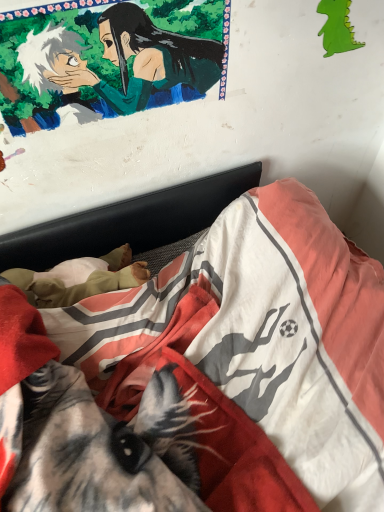
At what (x,y) coordinates should I click in order to perform the action: click on green paper dragon at upper right. Please return your answer as a coordinate pair (x, y). This screenshot has width=384, height=512. Looking at the image, I should click on (337, 27).

Measure the distance between point (28,459) and camera.

Point (28,459) is 27.87 inches away from camera.

Where is `soft cotton bed at center`? soft cotton bed at center is located at coordinates (206, 376).

You are a GUI agent. You are given a task and a screenshot of the screen. Output one action in this format:
    pyautogui.click(x=<x>, y=<y>)
    Task: Click on the green paper dragon at upper right
    Image resolution: width=384 pixels, height=512 pixels.
    Given the screenshot: What is the action you would take?
    pyautogui.click(x=337, y=27)

Can you tell me how much soft cotton bed at center and green paper dragon at upper right differ in facing direction?

They differ by 90.2 degrees in their facing directions.

Between point (345, 290) and point (352, 29), which one is positioned behind?

The point (352, 29) is farther.

Which object is further away from the camera taking this photo, soft cotton bed at center or green paper dragon at upper right?

green paper dragon at upper right is further away from the camera.

How distant is soft cotton bed at center from green paper dragon at upper right?

soft cotton bed at center and green paper dragon at upper right are 68.86 centimeters apart.

Which of these two, green paper dragon at upper right or soft cotton bed at center, stands shorter?

green paper dragon at upper right.

Consider the image. Is green paper dragon at upper right not close to soft cotton bed at center?

No, green paper dragon at upper right is not far away from soft cotton bed at center.

From a real-world perspective, who is located higher, green paper dragon at upper right or soft cotton bed at center?

In real-world perspective, green paper dragon at upper right is above.

From a real-world perspective, who is located lower, green paper dragon at upper right or smooth green fabric at upper left?

green paper dragon at upper right, from a real-world perspective.

In terms of size, does green paper dragon at upper right appear bigger or smaller than smooth green fabric at upper left?

Considering their sizes, green paper dragon at upper right takes up less space than smooth green fabric at upper left.

How distant is green paper dragon at upper right from smooth green fabric at upper left?

They are 13.34 inches apart.

Are smooth green fabric at upper left and soft cotton bed at center making contact?

There is a gap between smooth green fabric at upper left and soft cotton bed at center.

Considering the sizes of objects smooth green fabric at upper left and soft cotton bed at center in the image provided, who is bigger, smooth green fabric at upper left or soft cotton bed at center?

soft cotton bed at center is bigger.

From the image's perspective, is smooth green fabric at upper left above or below soft cotton bed at center?

Based on their image positions, smooth green fabric at upper left is located above soft cotton bed at center.

Which object is closer to the camera taking this photo, smooth green fabric at upper left or soft cotton bed at center?

soft cotton bed at center.

Is soft cotton bed at center inside the boundaries of smooth green fabric at upper left, or outside?

soft cotton bed at center is not inside smooth green fabric at upper left, it's outside.

Is soft cotton bed at center next to smooth green fabric at upper left?

soft cotton bed at center and smooth green fabric at upper left are not in contact.

Between soft cotton bed at center and smooth green fabric at upper left, which one has larger width?

Wider between the two is soft cotton bed at center.

Is soft cotton bed at center shorter than smooth green fabric at upper left?

In fact, soft cotton bed at center may be taller than smooth green fabric at upper left.

From a real-world perspective, is smooth green fabric at upper left positioned over green paper dragon at upper right based on gravity?

Correct, in the physical world, smooth green fabric at upper left is higher than green paper dragon at upper right.

Considering the relative sizes of smooth green fabric at upper left and green paper dragon at upper right in the image provided, is smooth green fabric at upper left wider than green paper dragon at upper right?

Indeed, smooth green fabric at upper left has a greater width compared to green paper dragon at upper right.

Is smooth green fabric at upper left at the right side of green paper dragon at upper right?

No.

Which of these two, smooth green fabric at upper left or green paper dragon at upper right, is smaller?

green paper dragon at upper right.

In the image, there is a soft cotton bed at center. Find the location of `art above it (from the image's perspective)`. art above it (from the image's perspective) is located at coordinates (337, 27).

Find the location of a particular element. bed on the left of green paper dragon at upper right is located at coordinates (206, 376).

When comparing their distances from soft cotton bed at center, does green paper dragon at upper right or smooth green fabric at upper left seem further?

Based on the image, green paper dragon at upper right appears to be further to soft cotton bed at center.

From the picture: From the image, which object appears to be farther from smooth green fabric at upper left, soft cotton bed at center or green paper dragon at upper right?

soft cotton bed at center lies further to smooth green fabric at upper left than the other object.

Based on their spatial positions, is green paper dragon at upper right or soft cotton bed at center closer to smooth green fabric at upper left?

The object closer to smooth green fabric at upper left is green paper dragon at upper right.

From the image, which object appears to be farther from soft cotton bed at center, smooth green fabric at upper left or green paper dragon at upper right?

green paper dragon at upper right is positioned further to the anchor soft cotton bed at center.

From the image, which object appears to be farther from green paper dragon at upper right, soft cotton bed at center or smooth green fabric at upper left?

soft cotton bed at center is further to green paper dragon at upper right.

When comparing their distances from green paper dragon at upper right, does smooth green fabric at upper left or soft cotton bed at center seem closer?

The object closer to green paper dragon at upper right is smooth green fabric at upper left.

The height and width of the screenshot is (512, 384). I want to click on woman between green paper dragon at upper right and soft cotton bed at center from top to bottom, so click(144, 60).